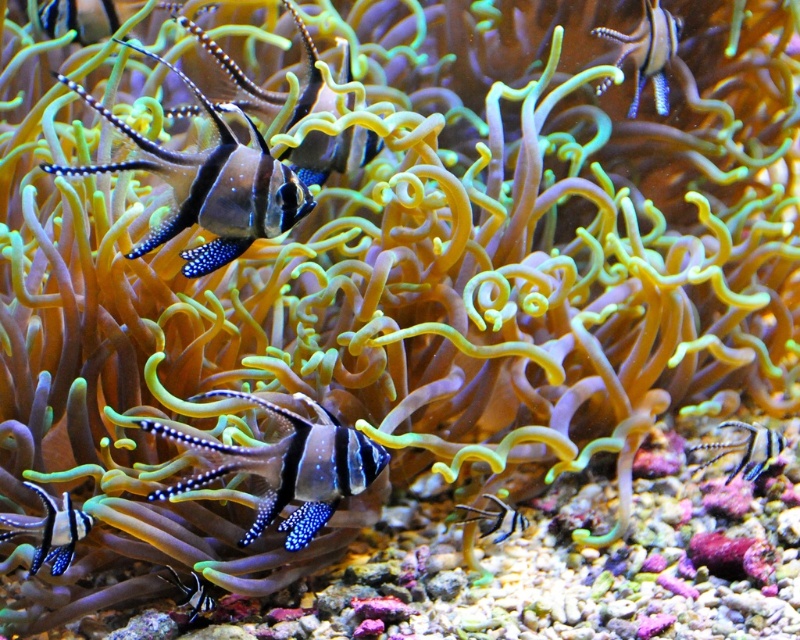
Measure the distance from blue dotted fin at upper right to black glossy fish at center.

The distance of blue dotted fin at upper right from black glossy fish at center is 34.76 inches.

Is blue dotted fin at upper right shorter than black glossy fish at center?

No, blue dotted fin at upper right is not shorter than black glossy fish at center.

The width and height of the screenshot is (800, 640). I want to click on blue dotted fin at upper right, so click(648, 51).

Between blue dotted fin at upper right and matte black fish at upper left, which one has less height?

With less height is matte black fish at upper left.

Does blue dotted fin at upper right appear over matte black fish at upper left?

No, blue dotted fin at upper right is not above matte black fish at upper left.

You are a GUI agent. You are given a task and a screenshot of the screen. Output one action in this format:
    pyautogui.click(x=<x>, y=<y>)
    Task: Click on the blue dotted fin at upper right
    The width and height of the screenshot is (800, 640).
    Given the screenshot: What is the action you would take?
    pyautogui.click(x=648, y=51)

Is shiny blue and black fish at center taller than black glossy fish at center?

Indeed, shiny blue and black fish at center has a greater height compared to black glossy fish at center.

Is shiny blue and black fish at center shorter than black glossy fish at center?

No.

Locate an element on the screen. shiny blue and black fish at center is located at coordinates (288, 467).